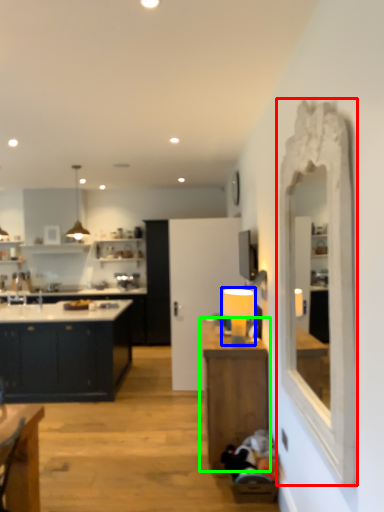
Question: Which is nearer to the mirror (highlighted by a red box)? lamp (highlighted by a blue box) or table (highlighted by a green box).

Choices:
 (A) lamp
 (B) table

Answer: (B)